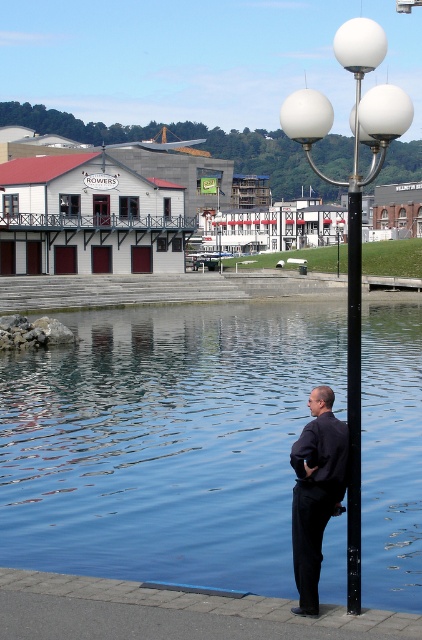
You are a photographer planning to capture a reflection shot of the blue smooth water at center and the white glossy lamp post at upper center. Since reflections are best captured when the sun is low, which object should you position closer to the camera to ensure the reflection of the other is clearly visible?

To capture the reflection of the white glossy lamp post at upper center in the blue smooth water at center, you should position the camera closer to the blue smooth water at center because the water is to the left of the lamp post. This positioning allows the light reflecting off the water to include the lamp post in its reflective surface, ensuring a clear reflection.